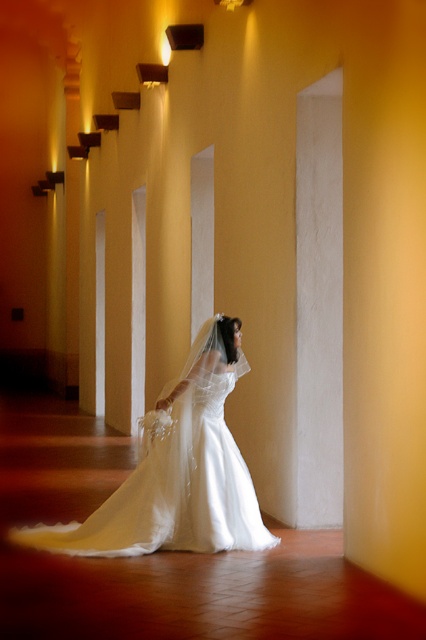
Question: Which point is closer to the camera?

Choices:
 (A) (307, 244)
 (B) (253, 516)

Answer: (B)

Question: Which of the following is the closest to the observer?

Choices:
 (A) (324, 161)
 (B) (201, 525)

Answer: (B)

Question: Can you confirm if white satin dress at center is smaller than white marble pillar at center?

Choices:
 (A) no
 (B) yes

Answer: (A)

Question: Does white satin dress at center have a larger size compared to white marble pillar at center?

Choices:
 (A) yes
 (B) no

Answer: (A)

Question: Which of the following is the farthest from the observer?

Choices:
 (A) white marble pillar at center
 (B) white satin dress at center

Answer: (A)

Question: Does white satin dress at center have a larger size compared to white marble pillar at center?

Choices:
 (A) no
 (B) yes

Answer: (B)